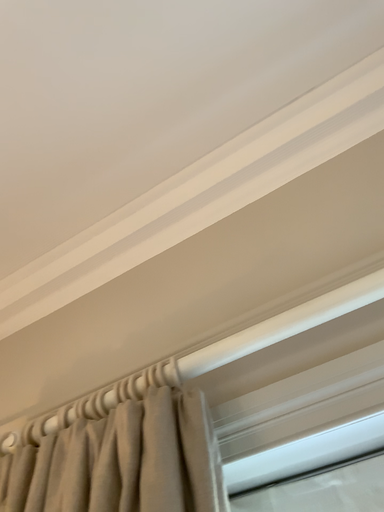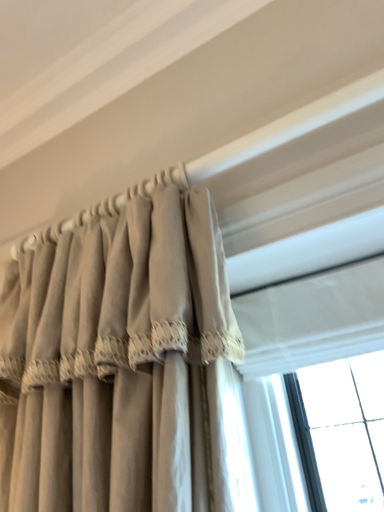
Question: How did the camera likely rotate when shooting the video?

Choices:
 (A) rotated upward
 (B) rotated downward

Answer: (B)